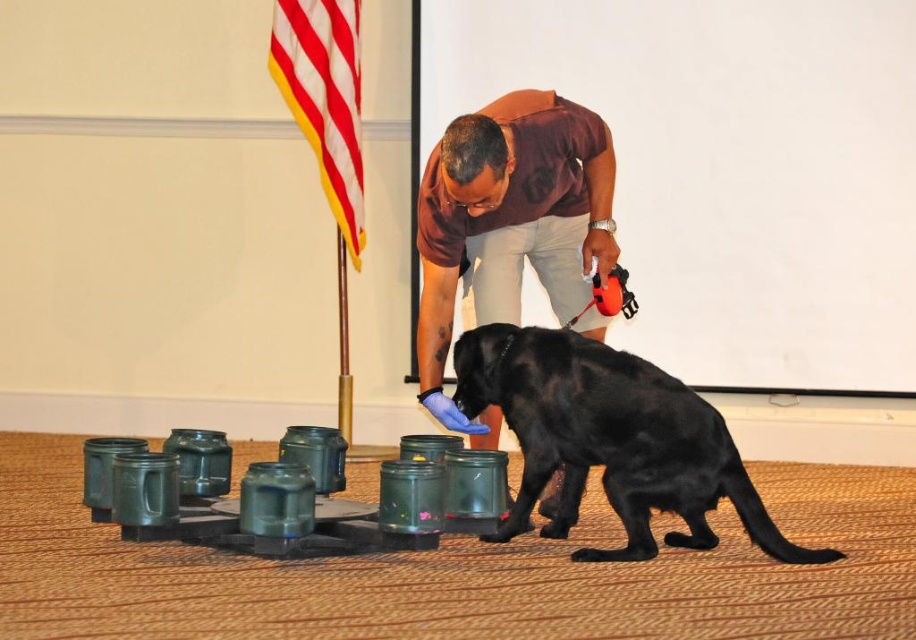
Between black matte dog at center and red and white striped flag at upper left, which one has more height?

Standing taller between the two is red and white striped flag at upper left.

Who is more forward, [773,532] or [293,22]?

Positioned in front is point [773,532].

Which is in front, point (453, 352) or point (295, 12)?

Positioned in front is point (453, 352).

The height and width of the screenshot is (640, 916). In order to click on black matte dog at center in this screenshot , I will do `click(609, 440)`.

I want to click on matte brown shirt at center, so (509, 225).

Is matte brown shirt at center positioned before red and white striped flag at upper left?

That is True.

Which is in front, point (465, 260) or point (358, 202)?

Point (465, 260)

Identify the location of matte brown shirt at center. The image size is (916, 640). (509, 225).

Looking at this image, is the position of black matte dog at center less distant than that of matte brown shirt at center?

That is False.

Between black matte dog at center and matte brown shirt at center, which one is positioned lower?

black matte dog at center

Is point (566, 468) positioned before point (466, 189)?

No, (566, 468) is further to viewer.

The image size is (916, 640). I want to click on black matte dog at center, so [x=609, y=440].